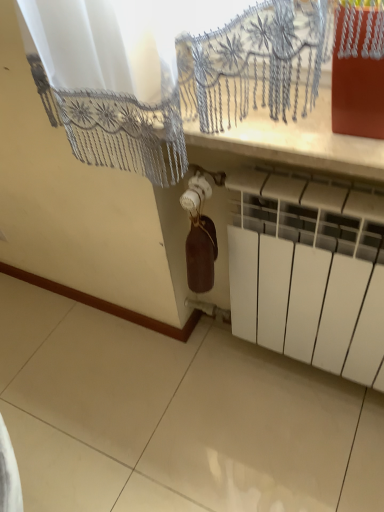
Question: Visually, is brown matte wine bottle at center positioned to the left or to the right of white matte radiator at lower right?

Choices:
 (A) right
 (B) left

Answer: (B)

Question: Looking at the image, does brown matte wine bottle at center seem bigger or smaller compared to white matte radiator at lower right?

Choices:
 (A) big
 (B) small

Answer: (B)

Question: From the image's perspective, is brown matte wine bottle at center above or below white matte radiator at lower right?

Choices:
 (A) above
 (B) below

Answer: (A)

Question: From the image's perspective, is white matte radiator at lower right located above or below brown matte wine bottle at center?

Choices:
 (A) above
 (B) below

Answer: (B)

Question: Is white matte radiator at lower right taller or shorter than brown matte wine bottle at center?

Choices:
 (A) short
 (B) tall

Answer: (B)

Question: Is white matte radiator at lower right bigger or smaller than brown matte wine bottle at center?

Choices:
 (A) big
 (B) small

Answer: (A)

Question: Relative to brown matte wine bottle at center, is white matte radiator at lower right in front or behind?

Choices:
 (A) behind
 (B) front

Answer: (B)